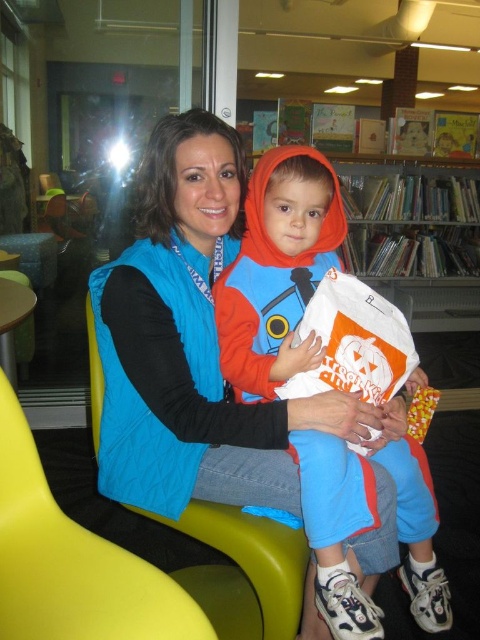
Question: Which of these objects is positioned farthest from the matte orange hoodie at center?

Choices:
 (A) wooden bookshelf at upper center
 (B) yellow plastic chair at lower left
 (C) matte plastic chair at center

Answer: (A)

Question: Which point appears farthest from the camera in this image?

Choices:
 (A) (29, 522)
 (B) (368, 273)

Answer: (B)

Question: Is matte orange hoodie at center to the right of yellow plastic chair at lower left from the viewer's perspective?

Choices:
 (A) no
 (B) yes

Answer: (B)

Question: Does matte orange hoodie at center have a lesser width compared to yellow plastic chair at lower left?

Choices:
 (A) yes
 (B) no

Answer: (B)

Question: Observing the image, what is the correct spatial positioning of matte orange hoodie at center in reference to yellow plastic chair at lower left?

Choices:
 (A) below
 (B) above

Answer: (B)

Question: Based on their relative distances, which object is farther from the yellow plastic chair at lower left?

Choices:
 (A) wooden bookshelf at upper center
 (B) matte orange hoodie at center

Answer: (A)